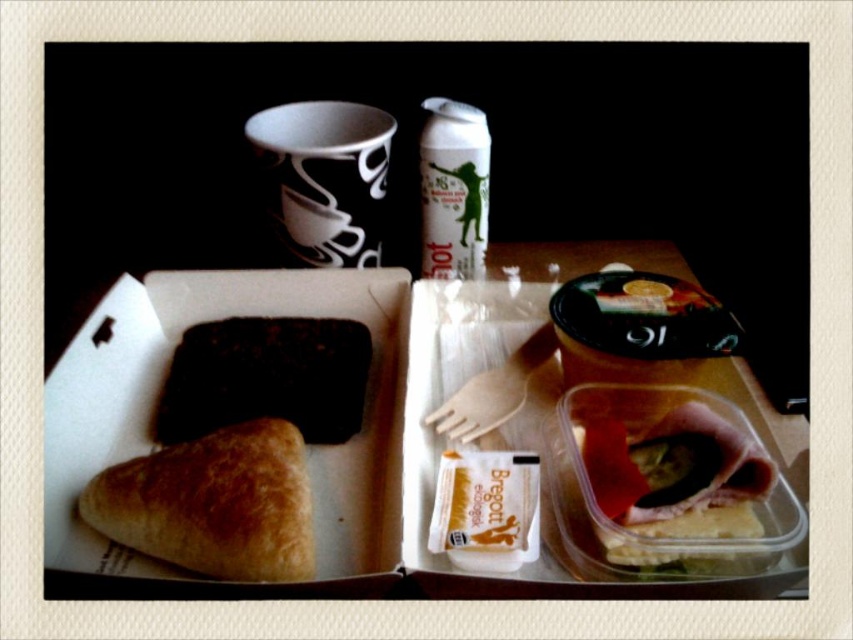
Consider the image. You are at a cafe table and want to grab the dark chocolate bar at center without moving the golden brown flaky croissant at lower left. Is this possible?

The golden brown flaky croissant at lower left is positioned under the dark chocolate bar at center, so you cannot grab the dark chocolate bar at center without moving the croissant first.

You are a food delivery robot that needs to pick up the golden brown flaky croissant at lower left and the dark chocolate bar at center from the table. The robot has a maximum reach of 10 centimeters. Can you reach both items without moving your arm?

The distance between the golden brown flaky croissant at lower left and the dark chocolate bar at center is 11.16 centimeters, which exceeds the robot arm reach of 10 centimeters. Therefore, the robot cannot reach both items without moving its arm.

You are standing at the point marked by the coordinates point [245,483]. You want to pick up the croissant and the chocolate square. Can you reach both items without moving your position?

The point marked by the coordinates point [245,483] is 25.06 inches away from you, so you can reach both the croissant and the chocolate square without moving your position since the distance is within a typical reach range.